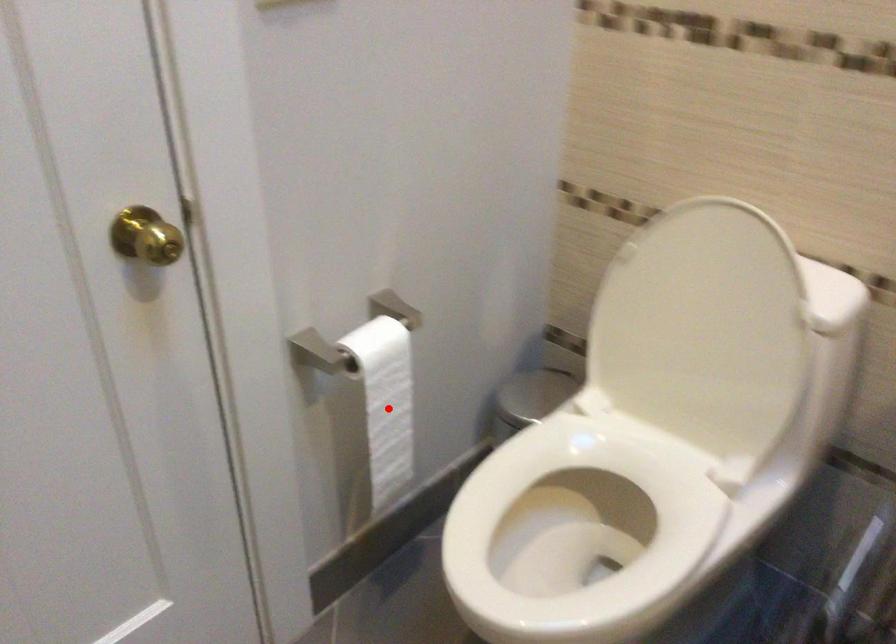
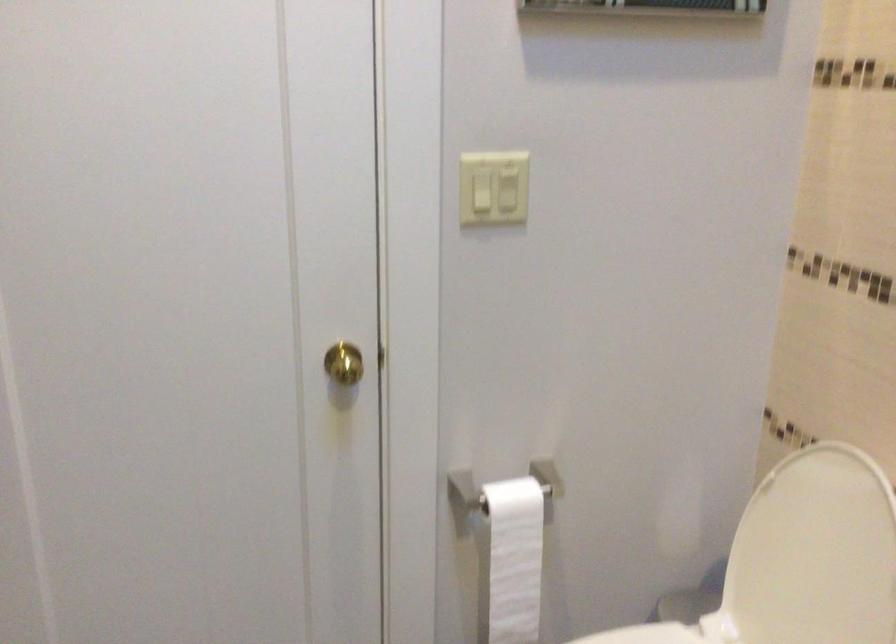
In the second image, find the point that corresponds to the highlighted location in the first image.

(513, 560)